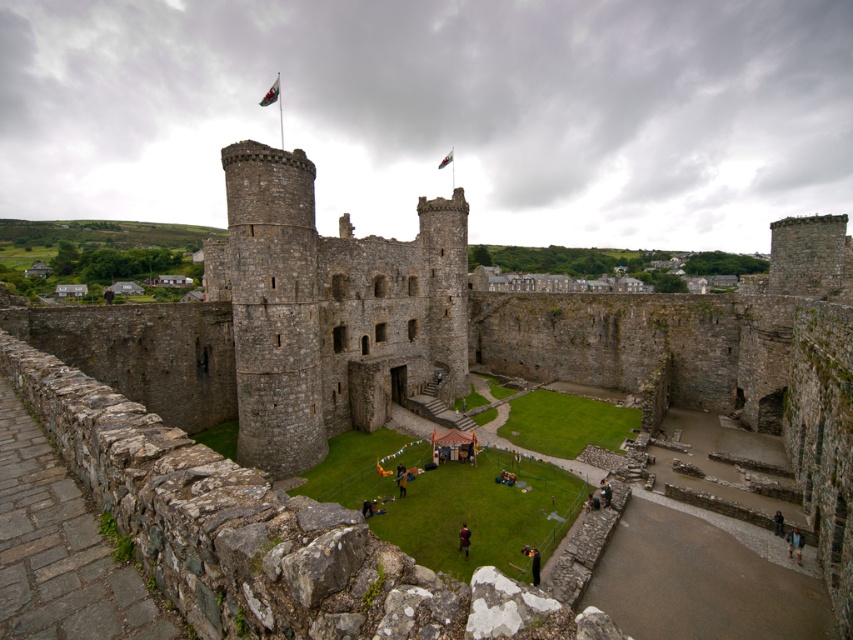
From the picture: You are a visitor standing in the courtyard of the castle. You see a light brown leather jacket at lower right and a green fabric flag at center. Which object is closer to the ground?

The light brown leather jacket at lower right is closer to the ground because it is below the green fabric flag at center.

You are a visitor standing in the courtyard of the castle. You see the green fabric flag at upper center and the dark brown leather jacket at center. Which object is higher in the scene?

The green fabric flag at upper center is above the dark brown leather jacket at center, so the green fabric flag at upper center is higher in the scene.

You are standing at the entrance of the castle courtyard and want to reach the central tower. There are two points marked on the ground, point A at coordinates point A is point (276, 84) and point B at coordinates point B is point (463, 554). According to the castle layout, which point is closer to the central tower?

Point A at coordinates point A is point (276, 84) is closer to the central tower because it is in front of point B at coordinates point B is point (463, 554), which is further away.